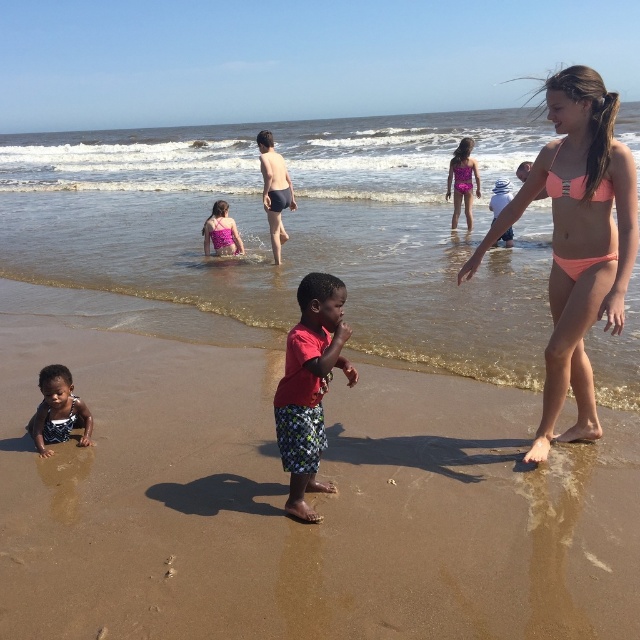
Question: Is clear water at center closer to camera compared to printed fabric bikini at lower left?

Choices:
 (A) no
 (B) yes

Answer: (A)

Question: Among these objects, which one is farthest from the camera?

Choices:
 (A) pink fabric swimsuit at center
 (B) purple shiny swimsuit at upper right
 (C) brown sandy beach at center

Answer: (B)

Question: Does pink bikini at right have a lesser width compared to printed fabric bikini at lower left?

Choices:
 (A) yes
 (B) no

Answer: (B)

Question: Is pink bikini at right thinner than white dotted swimsuit at lower left?

Choices:
 (A) yes
 (B) no

Answer: (B)

Question: Which of the following is the closest to the observer?

Choices:
 (A) white cotton hat at upper center
 (B) pink matte bikini at right

Answer: (B)

Question: Which of the following is the closest to the observer?

Choices:
 (A) (0, 464)
 (B) (611, 259)

Answer: (B)